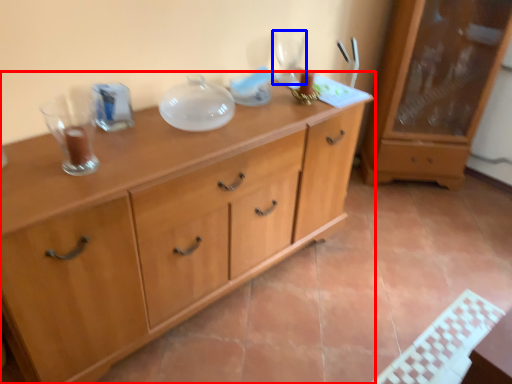
Question: Which point is closer to the camera, chest of drawers (highlighted by a red box) or wine glass (highlighted by a blue box)?

Choices:
 (A) chest of drawers
 (B) wine glass

Answer: (A)